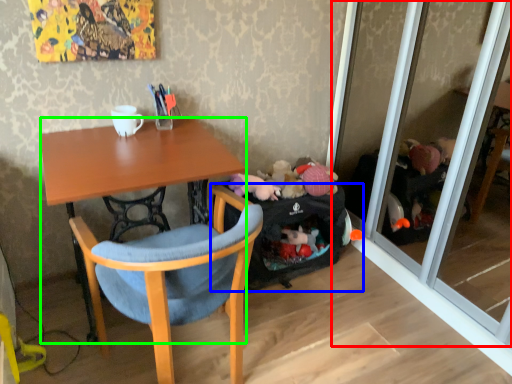
Question: Estimate the real-world distances between objects in this image. Which object is closer to screen door (highlighted by a red box), luggage and bags (highlighted by a blue box) or desk (highlighted by a green box)?

Choices:
 (A) luggage and bags
 (B) desk

Answer: (A)